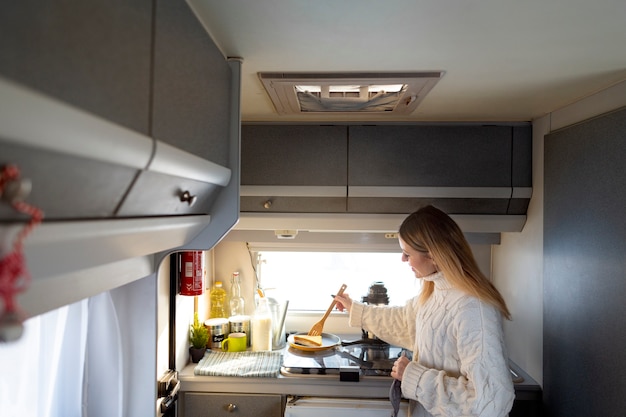
Where is `curtain`? The width and height of the screenshot is (626, 417). curtain is located at coordinates (106, 343).